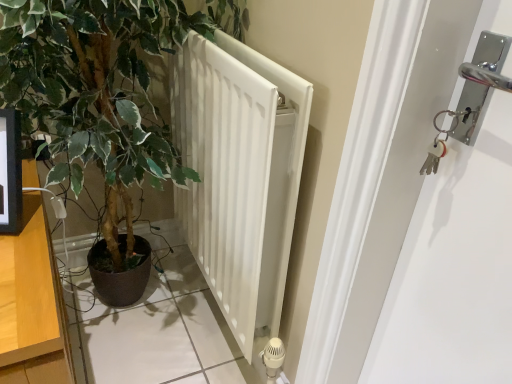
At what (x,y) coordinates should I click in order to perform the action: click on wooden dresser at left. Please return your answer as a coordinate pair (x, y). Looking at the image, I should click on pyautogui.click(x=32, y=304).

Locate an element on the screen. This screenshot has width=512, height=384. green leafy plant at center is located at coordinates coord(101,86).

Locate an element on the screen. This screenshot has width=512, height=384. wooden dresser at left is located at coordinates (32, 304).

From a real-world perspective, which object rests below the other?

white matte radiator at center, from a real-world perspective.

Which object is more forward, white matte radiator at center or green leafy plant at center?

green leafy plant at center is closer to the camera.

Choose the correct answer: Is white matte radiator at center inside green leafy plant at center or outside it?

white matte radiator at center can be found inside green leafy plant at center.

Which of these two, white matte radiator at center or green leafy plant at center, stands taller?

Standing taller between the two is green leafy plant at center.

Can you confirm if wooden dresser at left is thinner than white matte radiator at center?

In fact, wooden dresser at left might be wider than white matte radiator at center.

Does wooden dresser at left have a smaller size compared to white matte radiator at center?

Yes.

From a real-world perspective, is wooden dresser at left physically below white matte radiator at center?

Yes, from a real-world perspective, wooden dresser at left is below white matte radiator at center.

The width and height of the screenshot is (512, 384). In order to click on dresser located underneath the white matte radiator at center (from a real-world perspective) in this screenshot , I will do `click(32, 304)`.

Does white matte radiator at center contain wooden dresser at left?

No, wooden dresser at left is not inside white matte radiator at center.

Between white matte radiator at center and wooden dresser at left, which one has smaller width?

white matte radiator at center is thinner.

Considering the points (304, 126) and (1, 347), which point is behind, point (304, 126) or point (1, 347)?

Point (304, 126)

Considering the relative positions of white matte radiator at center and wooden dresser at left in the image provided, is white matte radiator at center to the right of wooden dresser at left from the viewer's perspective?

Correct, you'll find white matte radiator at center to the right of wooden dresser at left.

From a real-world perspective, which is physically above, wooden dresser at left or green leafy plant at center?

green leafy plant at center.

Can you tell me how much wooden dresser at left and green leafy plant at center differ in facing direction?

There is a 1.32-degree angle between the facing directions of wooden dresser at left and green leafy plant at center.

Is wooden dresser at left thinner than green leafy plant at center?

No.

From the image's perspective, which is below, green leafy plant at center or wooden dresser at left?

From the image's view, wooden dresser at left is below.

Is the depth of green leafy plant at center greater than that of wooden dresser at left?

Yes, green leafy plant at center is further from the camera.

Considering the points (165, 37) and (31, 357), which point is behind, point (165, 37) or point (31, 357)?

The point (165, 37) is behind.

Is green leafy plant at center aimed at wooden dresser at left?

Yes, green leafy plant at center is turned towards wooden dresser at left.

Would you say green leafy plant at center contains white matte radiator at center?

Yes, white matte radiator at center is inside green leafy plant at center.

From the image's perspective, would you say green leafy plant at center is positioned over white matte radiator at center?

Indeed, from the image's perspective, green leafy plant at center is shown above white matte radiator at center.

Is green leafy plant at center aimed at white matte radiator at center?

No, green leafy plant at center is not facing towards white matte radiator at center.

Which object is wider, green leafy plant at center or white matte radiator at center?

Wider between the two is green leafy plant at center.

This screenshot has width=512, height=384. In order to click on houseplant located above the white matte radiator at center (from the image's perspective) in this screenshot , I will do `click(101, 86)`.

This screenshot has height=384, width=512. Find the location of `dresser below the white matte radiator at center (from a real-world perspective)`. dresser below the white matte radiator at center (from a real-world perspective) is located at coordinates click(x=32, y=304).

Looking at the image, which one is located further to green leafy plant at center, wooden dresser at left or white matte radiator at center?

Based on the image, wooden dresser at left appears to be further to green leafy plant at center.

When comparing their distances from green leafy plant at center, does white matte radiator at center or wooden dresser at left seem closer?

white matte radiator at center is closer to green leafy plant at center.

Which object lies further to the anchor point white matte radiator at center, wooden dresser at left or green leafy plant at center?

wooden dresser at left lies further to white matte radiator at center than the other object.

Estimate the real-world distances between objects in this image. Which object is further from white matte radiator at center, green leafy plant at center or wooden dresser at left?

wooden dresser at left lies further to white matte radiator at center than the other object.

Which object lies further to the anchor point wooden dresser at left, green leafy plant at center or white matte radiator at center?

white matte radiator at center is positioned further to the anchor wooden dresser at left.

Looking at the image, which one is located closer to wooden dresser at left, white matte radiator at center or green leafy plant at center?

green leafy plant at center is closer to wooden dresser at left.

What are the coordinates of `houseplant between wooden dresser at left and white matte radiator at center from left to right` in the screenshot? It's located at (101, 86).